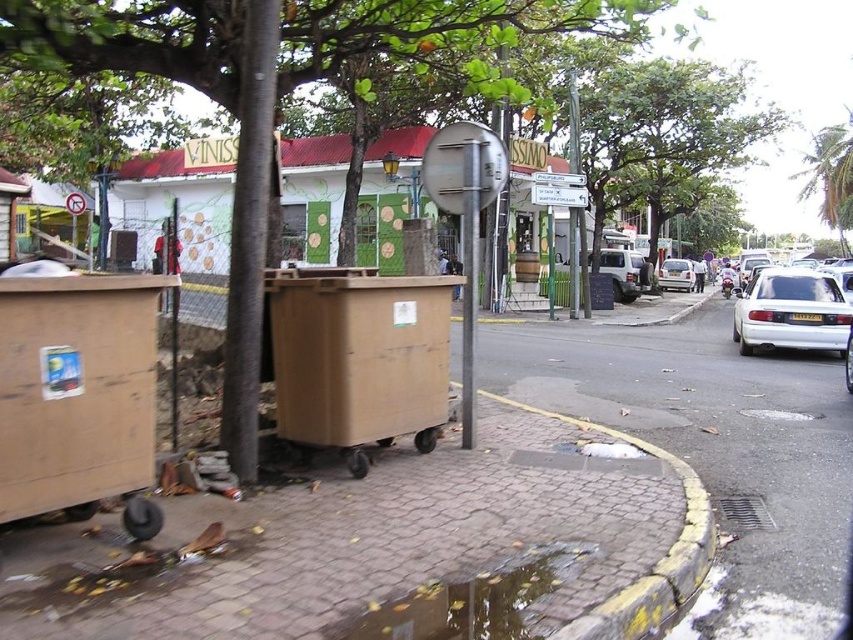
Question: Is brick pavement at center wider than white matte car at center?

Choices:
 (A) no
 (B) yes

Answer: (B)

Question: Which of these objects is positioned closest to the white matte car at center?

Choices:
 (A) green leafy tree at center
 (B) reflective wet pavement at lower center
 (C) green leafy tree at upper center

Answer: (C)

Question: From the image, what is the correct spatial relationship of brown cardboard at center in relation to white glossy sedan at right?

Choices:
 (A) left
 (B) right

Answer: (A)

Question: Which object appears closest to the camera in this image?

Choices:
 (A) white matte car at center
 (B) reflective wet pavement at lower center
 (C) green leafy tree at upper center

Answer: (B)

Question: Does brown cardboard at center have a smaller size compared to green leafy tree at center?

Choices:
 (A) no
 (B) yes

Answer: (A)

Question: Which object appears farthest from the camera in this image?

Choices:
 (A) white matte car at center
 (B) brown cardboard at center
 (C) brick pavement at center
 (D) reflective wet pavement at lower center

Answer: (A)